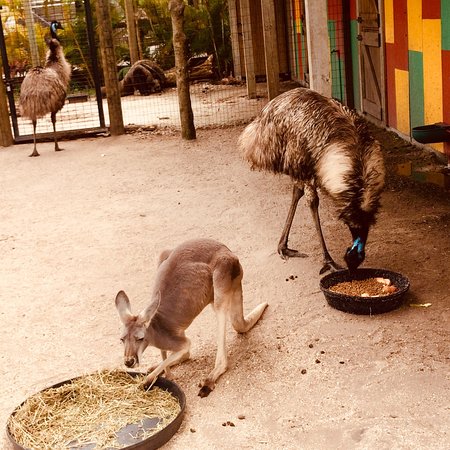
This screenshot has height=450, width=450. I want to click on floor, so click(x=329, y=362).